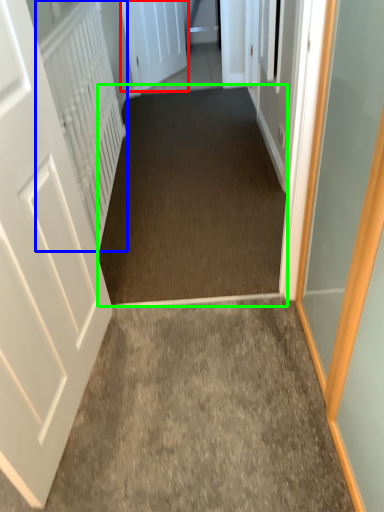
Question: Which is farther away from door (highlighted by a red box)? radiator (highlighted by a blue box) or corridor (highlighted by a green box)?

Choices:
 (A) radiator
 (B) corridor

Answer: (A)